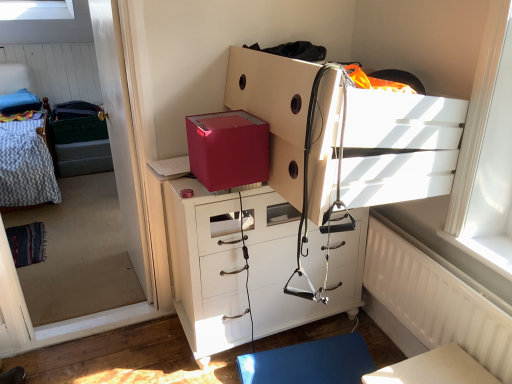
At what (x,y) coordinates should I click in order to perform the action: click on blank space situated above white glossy table at lower right (from a real-world perspective). Please return your answer as a coordinate pair (x, y). Looking at the image, I should click on (431, 372).